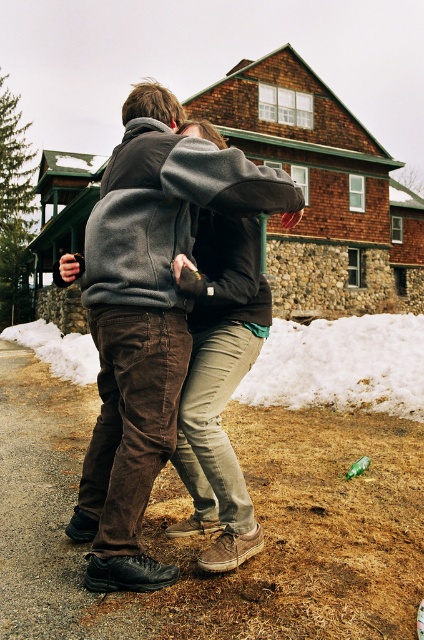
You are a photographer trying to capture the scene of two people hugging in front of the rustic wooden house. You notice the brown corduroy pants at center and the white powdery snow at lower center. Which object takes up more horizontal space in the image?

The white powdery snow at lower center takes up more horizontal space than the brown corduroy pants at center because the brown corduroy pants at center has a lesser width compared to white powdery snow at lower center.

You are standing at the origin point of the image. You see the brown corduroy pants at center represented by point (147, 316). What is the coordinate of the brown corduroy pants at center?

The coordinate of the brown corduroy pants at center is point (147, 316).